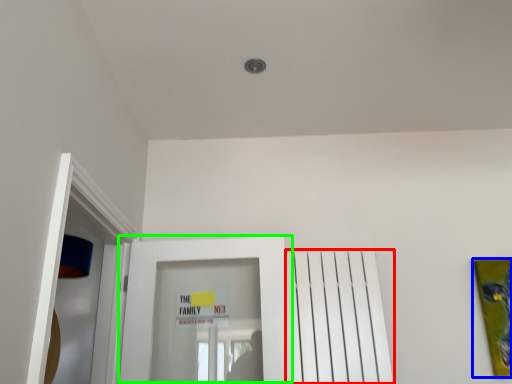
Question: Which object is the farthest from radiator (highlighted by a red box)? Choose among these: picture frame (highlighted by a blue box) or door (highlighted by a green box).

Choices:
 (A) picture frame
 (B) door

Answer: (A)